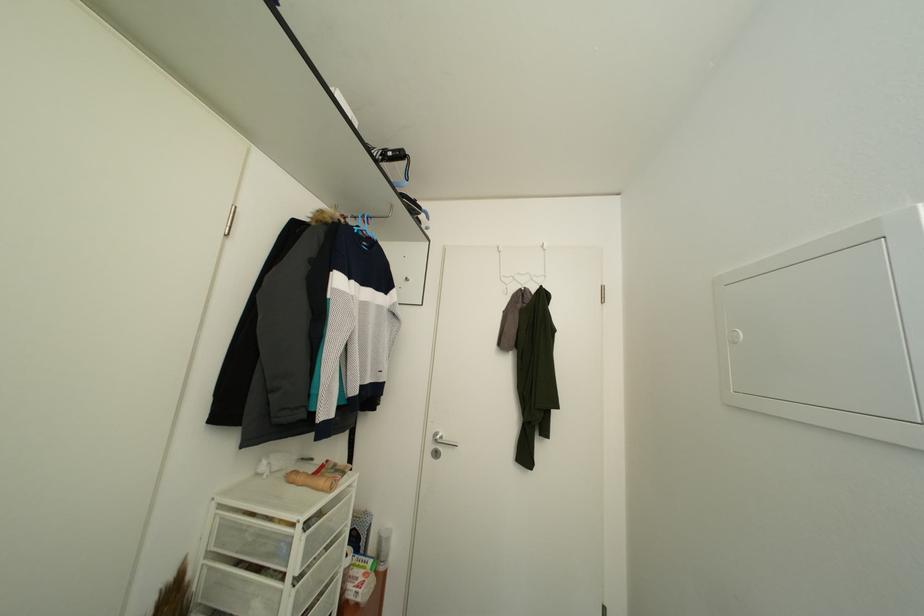
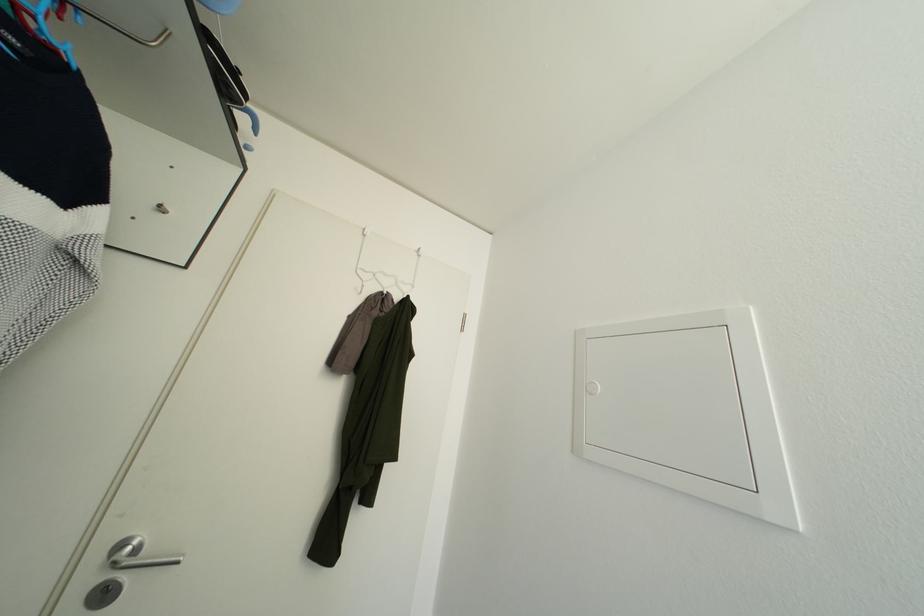
In the second image, find the point that corresponds to point 740,347 in the first image.

(598, 399)